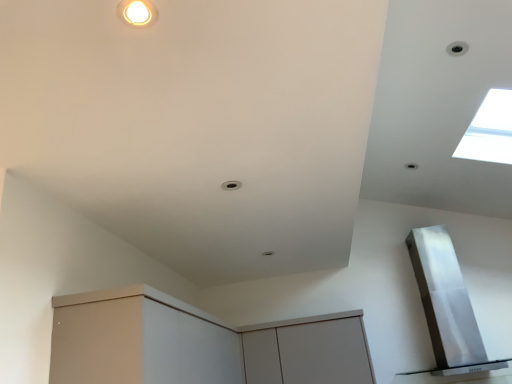
Question: From the image's perspective, does transparent glass window at upper right appear lower than matte white cabinet at lower left, acting as the 1th cabinetry starting from the left?

Choices:
 (A) yes
 (B) no

Answer: (B)

Question: From a real-world perspective, is transparent glass window at upper right on top of matte white cabinet at lower left, acting as the 1th cabinetry starting from the left?

Choices:
 (A) yes
 (B) no

Answer: (A)

Question: Is transparent glass window at upper right smaller than matte white cabinet at lower left, acting as the 1th cabinetry starting from the left?

Choices:
 (A) yes
 (B) no

Answer: (A)

Question: Can you confirm if transparent glass window at upper right is wider than matte white cabinet at lower left, marked as the second cabinetry in a right-to-left arrangement?

Choices:
 (A) no
 (B) yes

Answer: (A)

Question: From the image's perspective, is transparent glass window at upper right located above matte white cabinet at lower left, acting as the 1th cabinetry starting from the left?

Choices:
 (A) yes
 (B) no

Answer: (A)

Question: Choose the correct answer: Is matte white cabinet at lower left, marked as the second cabinetry in a right-to-left arrangement, inside satin silver exhaust hood at upper right or outside it?

Choices:
 (A) outside
 (B) inside

Answer: (A)

Question: Is matte white cabinet at lower left, acting as the 1th cabinetry starting from the left, wider or thinner than satin silver exhaust hood at upper right?

Choices:
 (A) thin
 (B) wide

Answer: (B)

Question: From the image's perspective, is matte white cabinet at lower left, marked as the second cabinetry in a right-to-left arrangement, positioned above or below satin silver exhaust hood at upper right?

Choices:
 (A) above
 (B) below

Answer: (B)

Question: In the image, is matte white cabinet at lower left, marked as the second cabinetry in a right-to-left arrangement, positioned in front of or behind satin silver exhaust hood at upper right?

Choices:
 (A) front
 (B) behind

Answer: (A)

Question: Relative to satin silver exhaust hood at upper right, is matte gray cabinet at center, positioned as the 1th cabinetry in right-to-left order, in front or behind?

Choices:
 (A) behind
 (B) front

Answer: (A)

Question: Do you think matte gray cabinet at center, which is the second cabinetry in left-to-right order, is within satin silver exhaust hood at upper right, or outside of it?

Choices:
 (A) inside
 (B) outside

Answer: (B)

Question: Based on their sizes in the image, would you say matte gray cabinet at center, which is the second cabinetry in left-to-right order, is bigger or smaller than satin silver exhaust hood at upper right?

Choices:
 (A) big
 (B) small

Answer: (B)

Question: From the image's perspective, is matte gray cabinet at center, positioned as the 1th cabinetry in right-to-left order, located above or below satin silver exhaust hood at upper right?

Choices:
 (A) above
 (B) below

Answer: (B)

Question: Considering the positions of matte white cabinet at lower left, acting as the 1th cabinetry starting from the left, and transparent glass window at upper right in the image, is matte white cabinet at lower left, acting as the 1th cabinetry starting from the left, wider or thinner than transparent glass window at upper right?

Choices:
 (A) wide
 (B) thin

Answer: (A)

Question: From the image's perspective, is matte white cabinet at lower left, marked as the second cabinetry in a right-to-left arrangement, located above or below transparent glass window at upper right?

Choices:
 (A) above
 (B) below

Answer: (B)